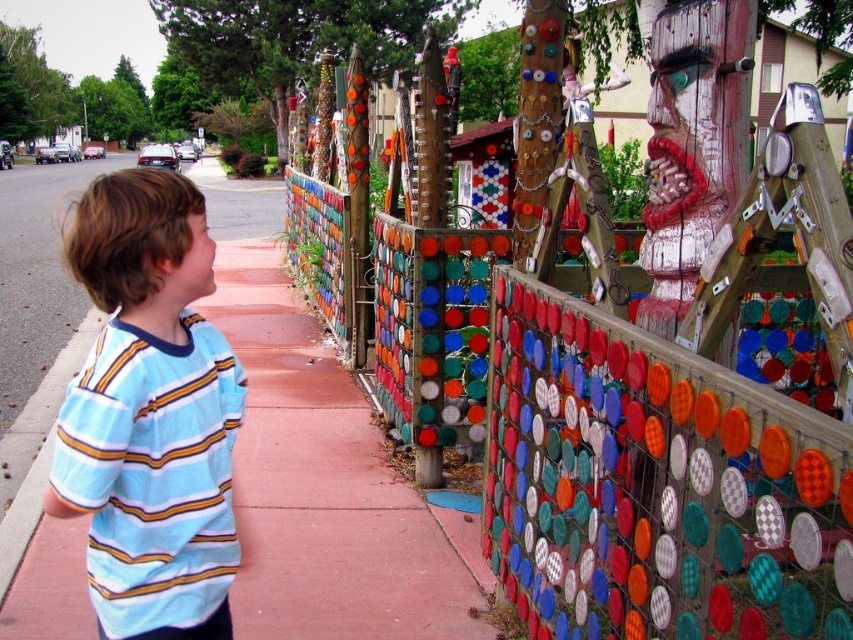
The boy is standing on the sidewalk looking at the multicolored mosaic fence at center. If the boy wants to walk directly towards the fence, which direction should he move in?

The multicolored mosaic fence at center is located at point (627, 461), so the boy should move forward towards the center of the image to reach it.

The boy is wearing a blue striped shirt at left and is looking at the multicolored mosaic fence at center. Which object is taller?

The multicolored mosaic fence at center is taller than the blue striped shirt at left.

You are standing on the sidewalk looking at the colorful fence. There are two points marked on the fence. The first point is at coordinate (718,394) and the second is at (320,576). Which point do you see closer to you?

The point at coordinate (718,394) is closer to the viewer than the point at (320,576).